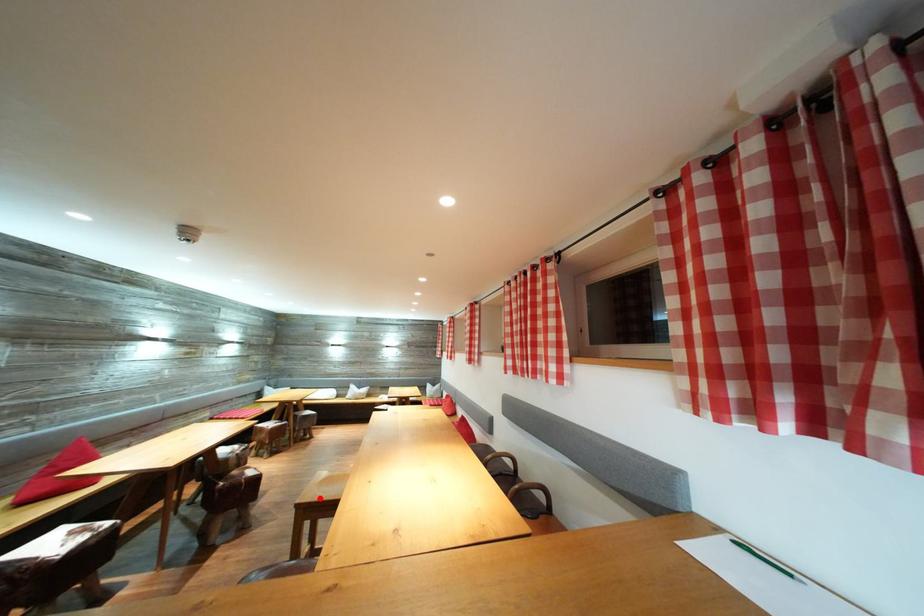
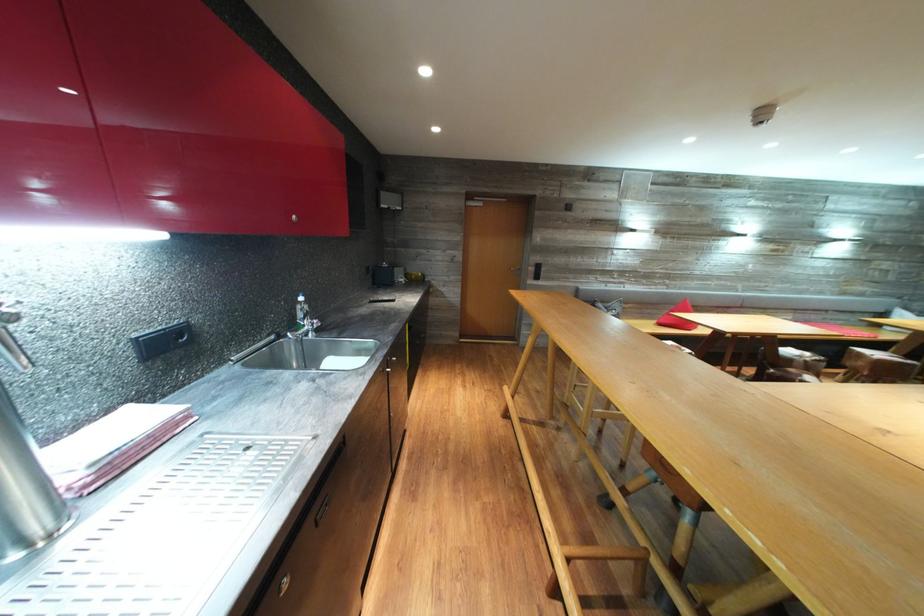
Question: I am providing you with two images of the same scene from different viewpoints. A red point is marked on the first image. Is the red point's position out of view in image 2?

Choices:
 (A) Yes
 (B) No

Answer: (A)